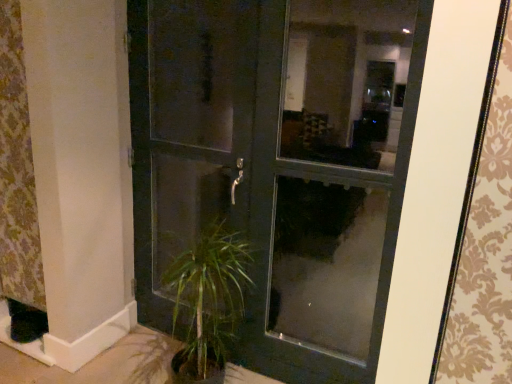
Question: Is matte black door at center in contact with patterned fabric curtain at left?

Choices:
 (A) yes
 (B) no

Answer: (B)

Question: Is matte black door at center smaller than patterned fabric curtain at left?

Choices:
 (A) no
 (B) yes

Answer: (A)

Question: Is matte black door at center behind patterned fabric curtain at left?

Choices:
 (A) yes
 (B) no

Answer: (B)

Question: Considering the relative sizes of matte black door at center and patterned fabric curtain at left in the image provided, is matte black door at center thinner than patterned fabric curtain at left?

Choices:
 (A) yes
 (B) no

Answer: (B)

Question: Does matte black door at center come in front of patterned fabric curtain at left?

Choices:
 (A) no
 (B) yes

Answer: (B)

Question: Is matte black door at center oriented away from patterned fabric curtain at left?

Choices:
 (A) yes
 (B) no

Answer: (B)

Question: From the image's perspective, does patterned fabric curtain at left appear lower than matte black door at center?

Choices:
 (A) yes
 (B) no

Answer: (B)

Question: Does patterned fabric curtain at left come in front of matte black door at center?

Choices:
 (A) yes
 (B) no

Answer: (B)

Question: Is patterned fabric curtain at left completely or partially outside of matte black door at center?

Choices:
 (A) yes
 (B) no

Answer: (A)

Question: From a real-world perspective, is patterned fabric curtain at left located beneath matte black door at center?

Choices:
 (A) yes
 (B) no

Answer: (B)

Question: From the image's perspective, would you say patterned fabric curtain at left is positioned over matte black door at center?

Choices:
 (A) no
 (B) yes

Answer: (B)

Question: Does patterned fabric curtain at left have a greater height compared to matte black door at center?

Choices:
 (A) yes
 (B) no

Answer: (B)

Question: Considering the relative sizes of matte black screen door at center and patterned fabric curtain at left in the image provided, is matte black screen door at center shorter than patterned fabric curtain at left?

Choices:
 (A) no
 (B) yes

Answer: (A)